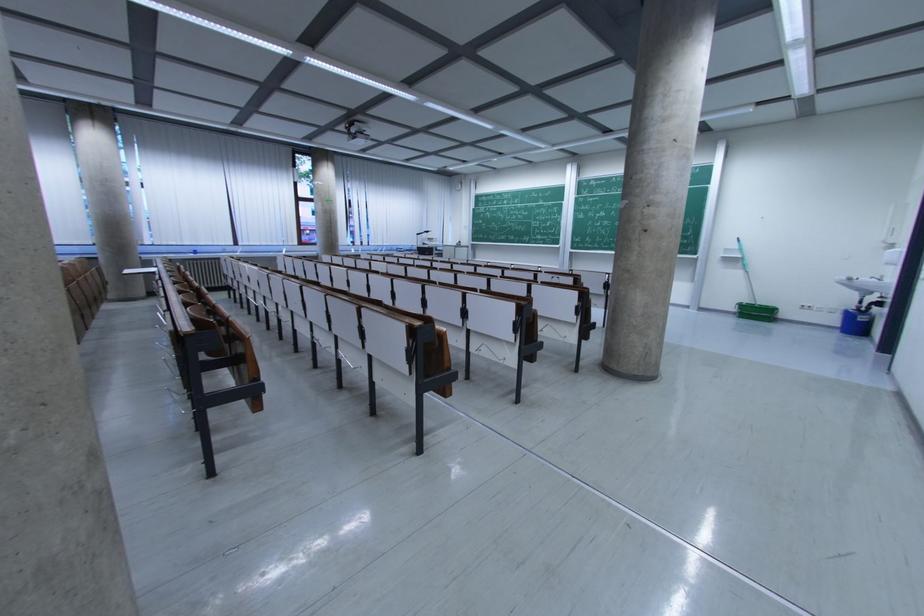
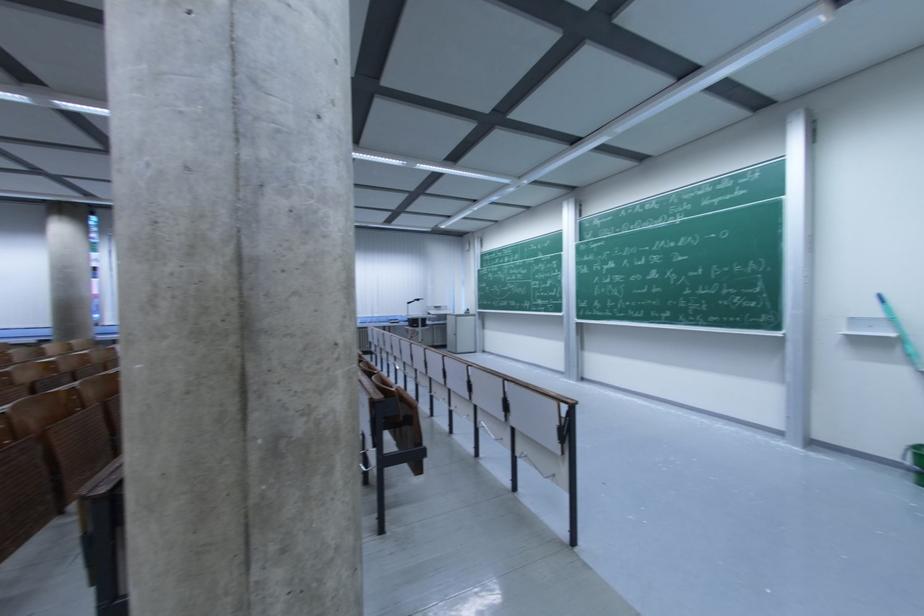
In a continuous first-person perspective shot, in which direction is the camera moving?

The cameraman moved toward right, forward.